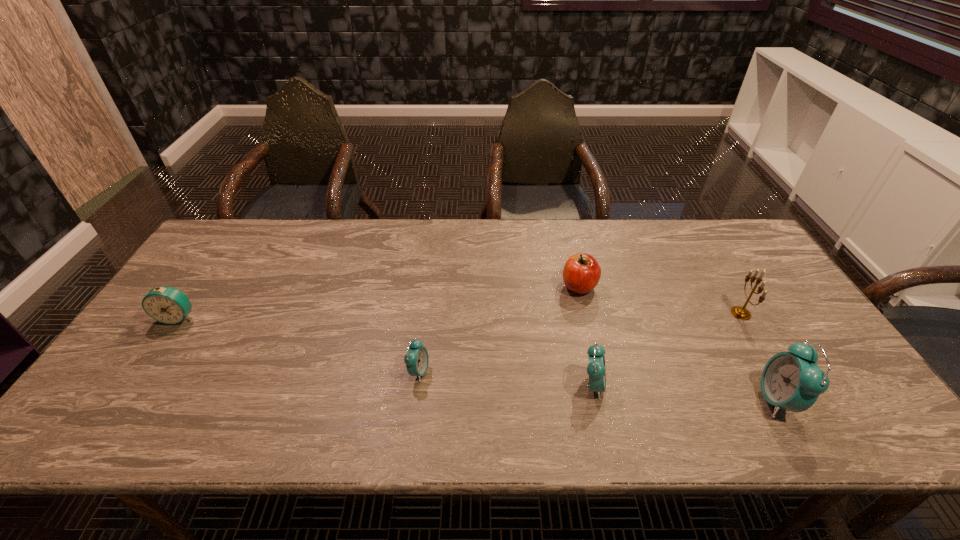
Identify the location of blank space located on the face of the tallest alarm clock. This screenshot has height=540, width=960. (684, 400).

The height and width of the screenshot is (540, 960). Find the location of `vacant space located 0.200m on the face of the tallest alarm clock`. vacant space located 0.200m on the face of the tallest alarm clock is located at coordinates pos(672,400).

The image size is (960, 540). In order to click on free space located on the face of the tallest alarm clock in this screenshot , I will do `click(650, 400)`.

Locate an element on the screen. This screenshot has width=960, height=540. free space located 0.320m on the left of the candelabrum is located at coordinates (616, 313).

The width and height of the screenshot is (960, 540). Find the location of `vacant space situated on the right of the apple`. vacant space situated on the right of the apple is located at coordinates (668, 286).

Locate an element on the screen. free location located on the front-facing side of the farthest alarm clock is located at coordinates (138, 376).

Where is `object that is positioned at the left edge`? Image resolution: width=960 pixels, height=540 pixels. object that is positioned at the left edge is located at coordinates (168, 305).

Where is `alarm clock that is at the right edge`? The width and height of the screenshot is (960, 540). alarm clock that is at the right edge is located at coordinates (793, 381).

Where is `candelabrum that is positioned at the right edge`? candelabrum that is positioned at the right edge is located at coordinates (739, 312).

Find the location of a particular element. object that is at the near right corner is located at coordinates (793, 381).